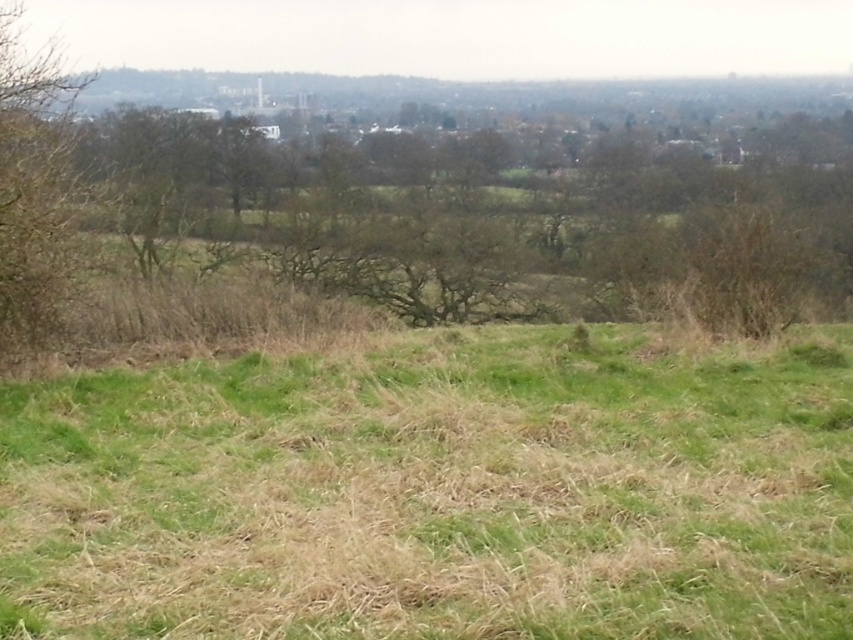
Consider the image. You are standing in the rural landscape and want to determine which tree is taller between the brown leafless tree at center and the brown leafy tree at left. Based on the scene, which one is taller?

The brown leafless tree at center is taller than the brown leafy tree at left.